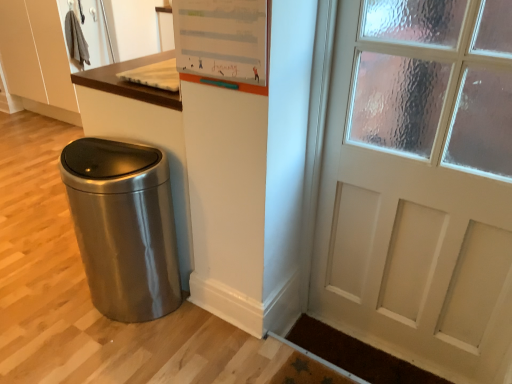
You are a GUI agent. You are given a task and a screenshot of the screen. Output one action in this format:
    pyautogui.click(x=<x>, y=<y>)
    Task: Click on the white matte dry erase board at upper center
    This screenshot has width=512, height=384.
    Given the screenshot: What is the action you would take?
    pyautogui.click(x=266, y=64)

What do you see at coordinates (266, 64) in the screenshot? This screenshot has height=384, width=512. I see `white matte dry erase board at upper center` at bounding box center [266, 64].

Measure the distance between brown textured mat at lower right and camera.

brown textured mat at lower right and camera are 5.59 feet apart.

At what (x,y) coordinates should I click in order to perform the action: click on white matte dry erase board at upper center. Please return your answer as a coordinate pair (x, y). Looking at the image, I should click on (266, 64).

In terms of width, does satin metallic trash can at lower left look wider or thinner when compared to white matte dry erase board at upper center?

Clearly, satin metallic trash can at lower left has more width compared to white matte dry erase board at upper center.

Considering the sizes of objects satin metallic trash can at lower left and white matte dry erase board at upper center in the image provided, who is taller, satin metallic trash can at lower left or white matte dry erase board at upper center?

satin metallic trash can at lower left is taller.

How many degrees apart are the facing directions of satin metallic trash can at lower left and white matte dry erase board at upper center?

satin metallic trash can at lower left and white matte dry erase board at upper center are facing 4.07 degrees away from each other.

From the image's perspective, does white matte dry erase board at upper center appear lower than brown textured mat at lower right?

Actually, white matte dry erase board at upper center appears above brown textured mat at lower right in the image.

Could you tell me if white matte dry erase board at upper center is turned towards brown textured mat at lower right?

No.

Which object is positioned more to the right, white matte dry erase board at upper center or brown textured mat at lower right?

From the viewer's perspective, brown textured mat at lower right appears more on the right side.

Considering the relative sizes of white matte dry erase board at upper center and brown textured mat at lower right in the image provided, is white matte dry erase board at upper center bigger than brown textured mat at lower right?

Actually, white matte dry erase board at upper center might be smaller than brown textured mat at lower right.

Considering the relative sizes of brown textured mat at lower right and satin metallic trash can at lower left in the image provided, is brown textured mat at lower right shorter than satin metallic trash can at lower left?

Yes.

From the picture: Does brown textured mat at lower right turn towards satin metallic trash can at lower left?

No, brown textured mat at lower right is not facing towards satin metallic trash can at lower left.

Is brown textured mat at lower right far away from satin metallic trash can at lower left?

Actually, brown textured mat at lower right and satin metallic trash can at lower left are a little close together.

In terms of size, does brown textured mat at lower right appear bigger or smaller than satin metallic trash can at lower left?

In the image, brown textured mat at lower right appears to be smaller than satin metallic trash can at lower left.

Between white matte dry erase board at upper center and satin metallic trash can at lower left, which one has less height?

With less height is white matte dry erase board at upper center.

Considering the positions of objects white matte dry erase board at upper center and satin metallic trash can at lower left in the image provided, who is more to the right, white matte dry erase board at upper center or satin metallic trash can at lower left?

white matte dry erase board at upper center.

Is point (264, 95) positioned before point (140, 179)?

Yes, point (264, 95) is in front of point (140, 179).

In the image, is white matte dry erase board at upper center positioned in front of or behind satin metallic trash can at lower left?

white matte dry erase board at upper center is in front of satin metallic trash can at lower left.

Who is more distant, satin metallic trash can at lower left or brown textured mat at lower right?

brown textured mat at lower right.

From the image's perspective, is satin metallic trash can at lower left beneath brown textured mat at lower right?

Incorrect, from the image's perspective, satin metallic trash can at lower left is higher than brown textured mat at lower right.

Choose the correct answer: Is satin metallic trash can at lower left inside brown textured mat at lower right or outside it?

The correct answer is: outside.

How different are the orientations of satin metallic trash can at lower left and brown textured mat at lower right in degrees?

There is a 7.83-degree angle between the facing directions of satin metallic trash can at lower left and brown textured mat at lower right.

Between brown textured mat at lower right and white matte dry erase board at upper center, which one appears on the left side from the viewer's perspective?

white matte dry erase board at upper center is more to the left.

Is brown textured mat at lower right inside or outside of white matte dry erase board at upper center?

brown textured mat at lower right is not inside white matte dry erase board at upper center, it's outside.

Based on the photo, considering the sizes of objects brown textured mat at lower right and white matte dry erase board at upper center in the image provided, who is bigger, brown textured mat at lower right or white matte dry erase board at upper center?

Bigger between the two is brown textured mat at lower right.

Is brown textured mat at lower right aimed at white matte dry erase board at upper center?

No, brown textured mat at lower right is not aimed at white matte dry erase board at upper center.

This screenshot has height=384, width=512. Identify the location of waste container that appears below the white matte dry erase board at upper center (from the image's perspective). (124, 226).

Identify the location of bulletin board above the brown textured mat at lower right (from the image's perspective). (266, 64).

Considering their positions, is white matte dry erase board at upper center positioned further to brown textured mat at lower right than satin metallic trash can at lower left?

Based on the image, white matte dry erase board at upper center appears to be further to brown textured mat at lower right.

From the image, which object appears to be nearer to white matte dry erase board at upper center, brown textured mat at lower right or satin metallic trash can at lower left?

satin metallic trash can at lower left lies closer to white matte dry erase board at upper center than the other object.

Based on their spatial positions, is satin metallic trash can at lower left or brown textured mat at lower right further from white matte dry erase board at upper center?

brown textured mat at lower right is positioned further to the anchor white matte dry erase board at upper center.

Based on the photo, looking at the image, which one is located further to satin metallic trash can at lower left, brown textured mat at lower right or white matte dry erase board at upper center?

Based on the image, brown textured mat at lower right appears to be further to satin metallic trash can at lower left.

Estimate the real-world distances between objects in this image. Which object is closer to satin metallic trash can at lower left, white matte dry erase board at upper center or brown textured mat at lower right?

white matte dry erase board at upper center lies closer to satin metallic trash can at lower left than the other object.

Considering their positions, is satin metallic trash can at lower left positioned further to brown textured mat at lower right than white matte dry erase board at upper center?

white matte dry erase board at upper center lies further to brown textured mat at lower right than the other object.

You are a GUI agent. You are given a task and a screenshot of the screen. Output one action in this format:
    pyautogui.click(x=<x>, y=<y>)
    Task: Click on the waste container between white matte dry erase board at upper center and brown textured mat at lower right from top to bottom
    This screenshot has height=384, width=512.
    Given the screenshot: What is the action you would take?
    pyautogui.click(x=124, y=226)